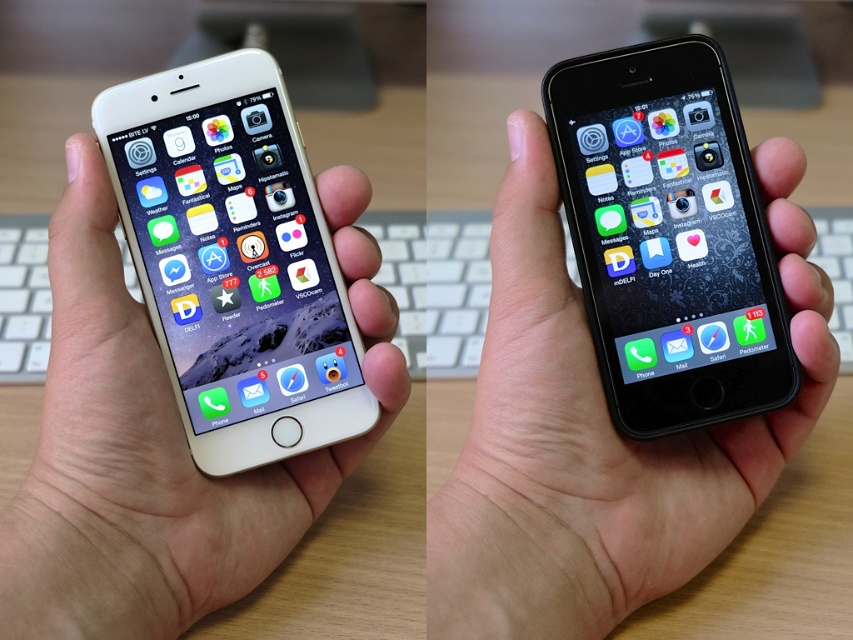
You are looking at the image of two smartphones. There are two points marked in the image. One is at coordinates point (x=370, y=253) and the other is at point (x=651, y=413). Which point is closer to you?

Point (x=370, y=253) is closer to you because it is further to the viewer than point (x=651, y=413).

You are setting up a photo shoot and need to position the gold matte phone at left precisely. According to the coordinates provided, where should you place it on the grid?

The gold matte phone at left should be placed at the coordinates point (x=234, y=260) as specified.

You are comparing two smartphones placed side by side. The gold matte iPhone at center and the black matte smartphone at center. Which one has a bigger screen?

The gold matte iPhone at center has a larger size compared to the black matte smartphone at center, so it likely has a bigger screen.